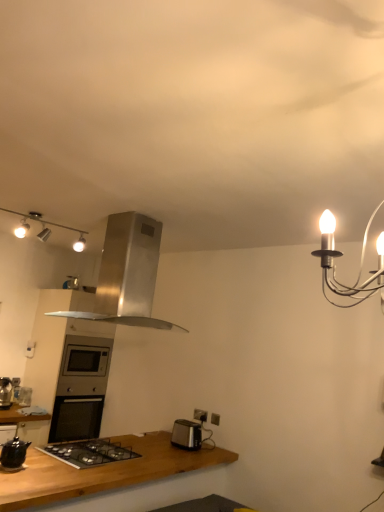
Identify the location of free space to the left of satin silver toaster at lower center. This screenshot has height=512, width=384. (162, 441).